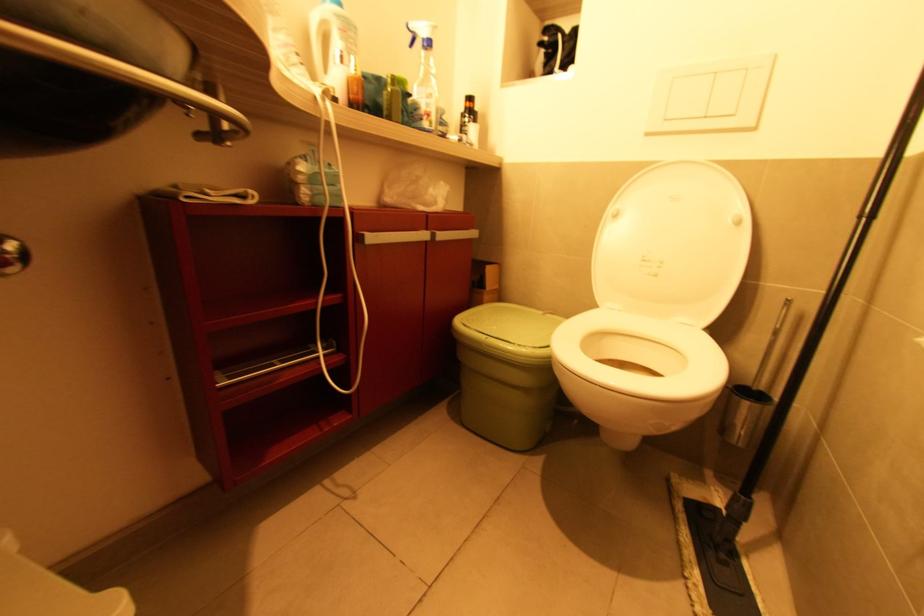
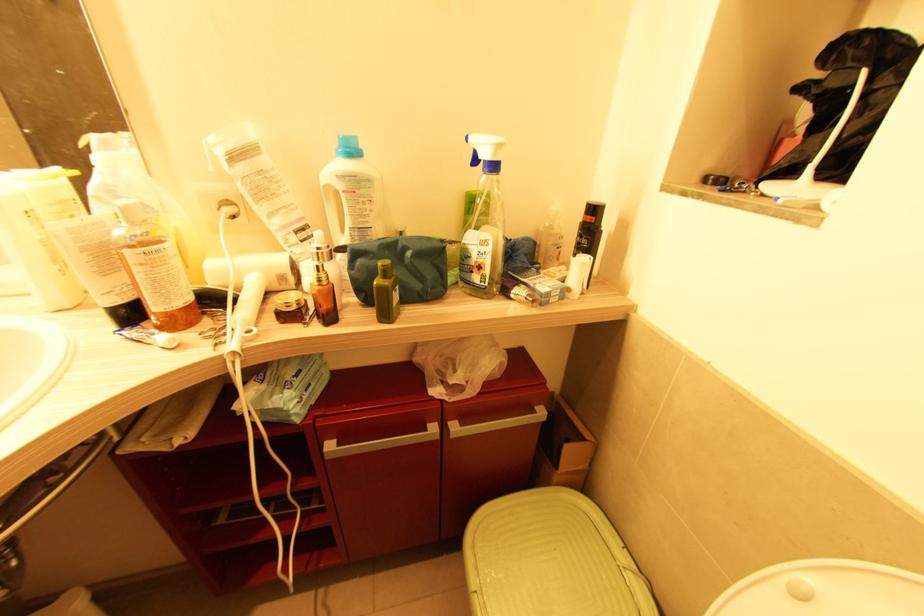
Find the pixel in the second image that matches point (424, 121) in the first image.

(473, 273)